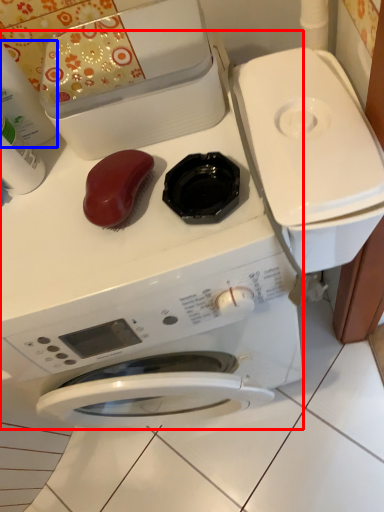
Question: Which of the following is the closest to the observer, washing machine (highlighted by a red box) or cleaning product (highlighted by a blue box)?

Choices:
 (A) washing machine
 (B) cleaning product

Answer: (A)